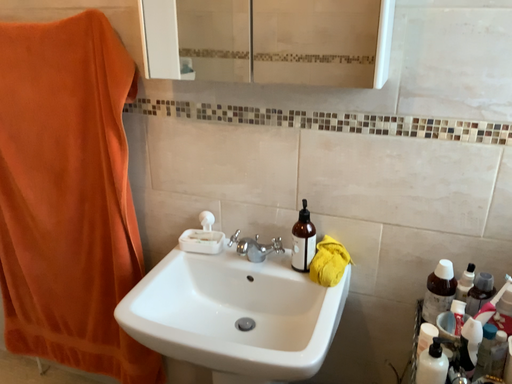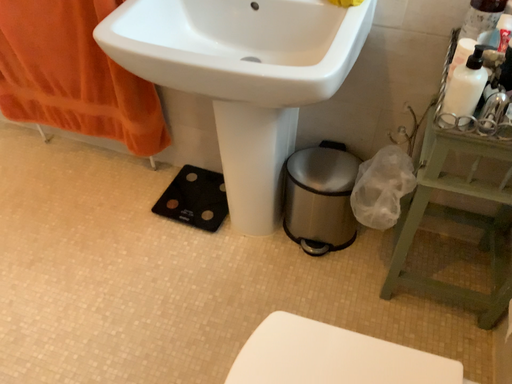
Question: How did the camera likely rotate when shooting the video?

Choices:
 (A) rotated downward
 (B) rotated upward

Answer: (A)